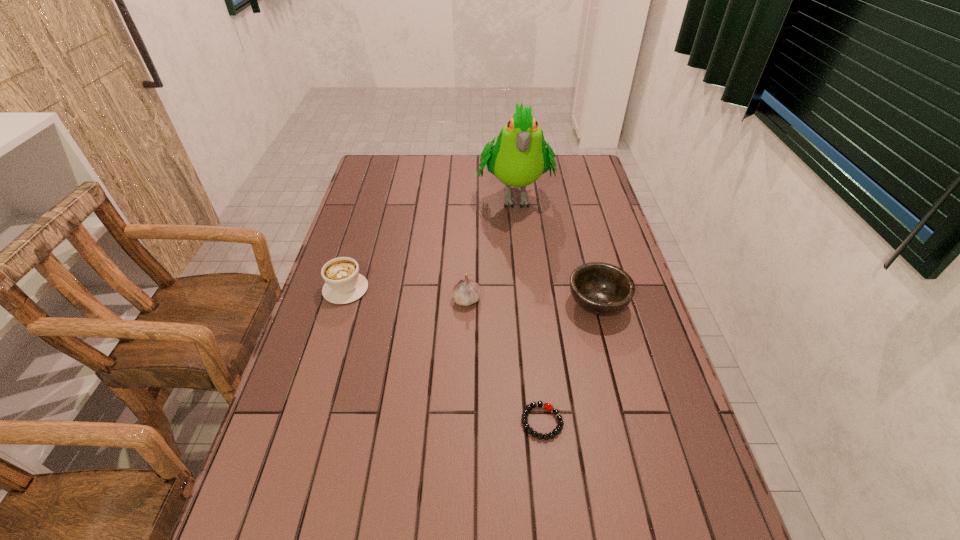
Where is `free space located 0.310m to the right of the cappuccino's handle`? free space located 0.310m to the right of the cappuccino's handle is located at coordinates coord(369,213).

In order to click on vacant space located 0.180m to the right of the cappuccino's handle in this screenshot , I will do `click(362, 235)`.

At what (x,y) coordinates should I click in order to perform the action: click on vacant space situated on the front of the bowl. Please return your answer as a coordinate pair (x, y). This screenshot has width=960, height=540. Looking at the image, I should click on (632, 435).

At what (x,y) coordinates should I click in order to perform the action: click on free location located on the back of the nearest object. Please return your answer as a coordinate pair (x, y). The width and height of the screenshot is (960, 540). Looking at the image, I should click on (532, 333).

The width and height of the screenshot is (960, 540). Identify the location of object that is at the far edge. (520, 156).

Where is `object at the left edge`? This screenshot has width=960, height=540. object at the left edge is located at coordinates (344, 284).

The height and width of the screenshot is (540, 960). What are the coordinates of `object at the right edge` in the screenshot? It's located at (599, 288).

I want to click on vacant space at the far edge of the desktop, so click(x=444, y=179).

I want to click on vacant space at the left edge of the desktop, so click(x=361, y=315).

In the image, there is a desktop. Find the location of `vacant space at the right edge`. vacant space at the right edge is located at coordinates (633, 334).